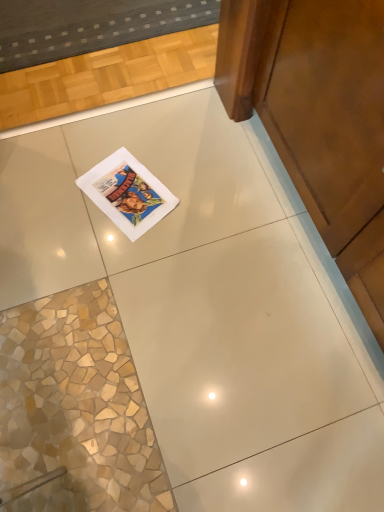
What do you see at coordinates (127, 193) in the screenshot? I see `matte paper magazine at center` at bounding box center [127, 193].

You are a GUI agent. You are given a task and a screenshot of the screen. Output one action in this format:
    pyautogui.click(x=<x>, y=<y>)
    Task: Click on the matte paper magazine at center
    Image resolution: width=384 pixels, height=512 pixels.
    Given the screenshot: What is the action you would take?
    pyautogui.click(x=127, y=193)

What is the approximate height of matte paper magazine at center?

matte paper magazine at center is 0.55 inches tall.

Where is `matte paper magazine at center`? The width and height of the screenshot is (384, 512). matte paper magazine at center is located at coordinates (127, 193).